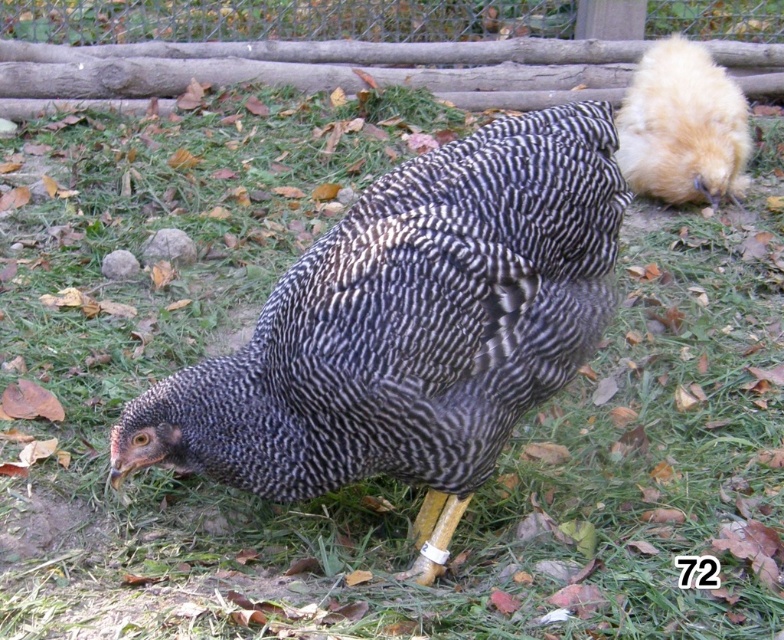
You are a farmer checking on your chickens. You want to catch the speckled feathered chicken at center and the golden fluffy chicken at upper right. Which chicken should you approach first to catch them in order from nearest to farthest?

You should approach the speckled feathered chicken at center first because it is closer to you than the golden fluffy chicken at upper right.

You are a farmer checking the chicken coop. You see the speckled feathered chicken at center and the golden fluffy chicken at upper right. Which chicken is positioned lower in the image?

The speckled feathered chicken at center is positioned lower in the image than the golden fluffy chicken at upper right.

You are a farmer checking the fence for any gaps. You notice the golden fluffy chicken at upper right and the wooden fence at upper center. Can the chicken possibly escape through the fence?

The golden fluffy chicken at upper right is behind wooden fence at upper center, so it is currently on the enclosed side. However, without information about the fence integrity or gaps, we can only confirm its position relative to the fence.